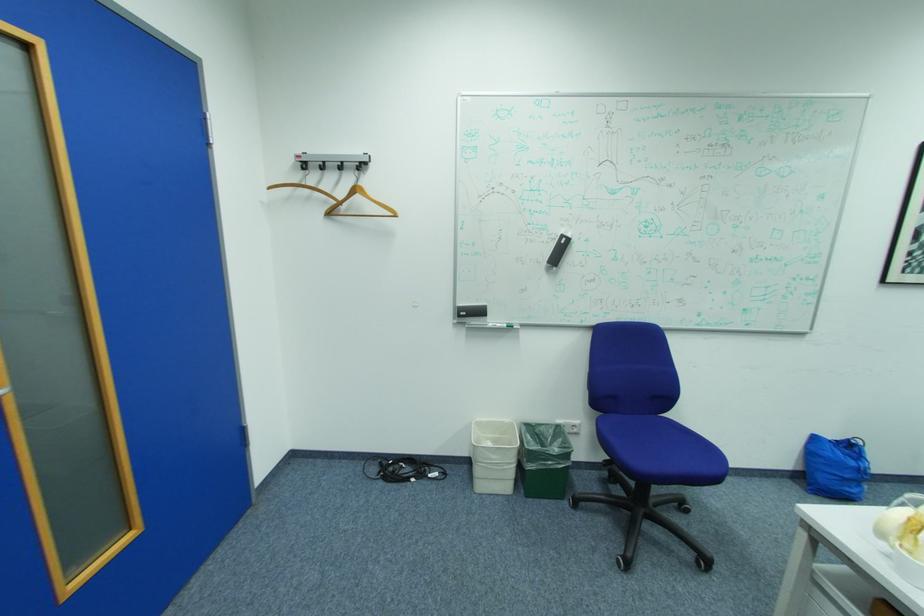
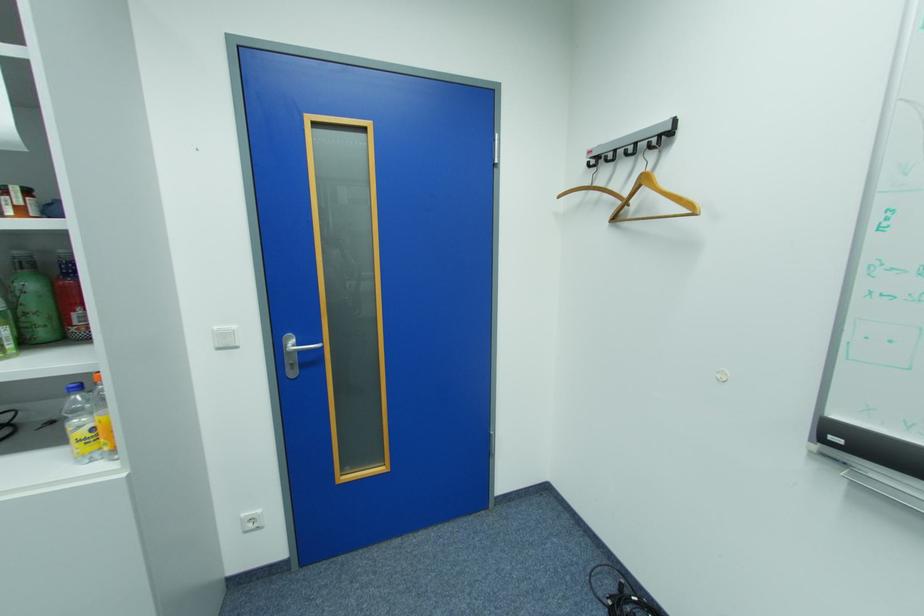
In the second image, find the point that corresponds to pixel 470 314 in the first image.

(845, 440)